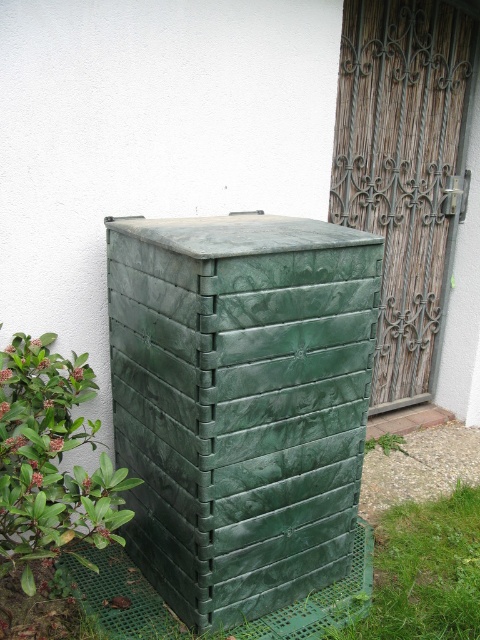
Question: Estimate the real-world distances between objects in this image. Which object is closer to the wooden textured door at right?

Choices:
 (A) green grass at lower right
 (B) green plastic crate at center

Answer: (B)

Question: Does wooden textured door at right have a larger size compared to green grass at lower right?

Choices:
 (A) no
 (B) yes

Answer: (B)

Question: Which point is closer to the camera taking this photo?

Choices:
 (A) (397, 604)
 (B) (300, 589)

Answer: (A)

Question: Which of these objects is positioned closest to the green grass at lower right?

Choices:
 (A) wooden textured door at right
 (B) green plastic crate at center

Answer: (B)

Question: From the image, what is the correct spatial relationship of green plastic crate at center in relation to wooden textured door at right?

Choices:
 (A) right
 (B) left

Answer: (B)

Question: Is wooden textured door at right bigger than green grass at lower right?

Choices:
 (A) yes
 (B) no

Answer: (A)